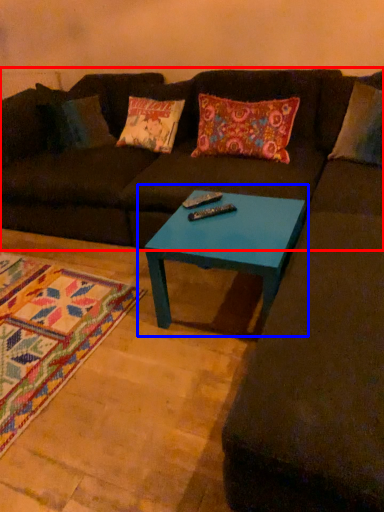
Question: Which object is further to the camera taking this photo, futon (highlighted by a red box) or coffee table (highlighted by a blue box)?

Choices:
 (A) futon
 (B) coffee table

Answer: (A)